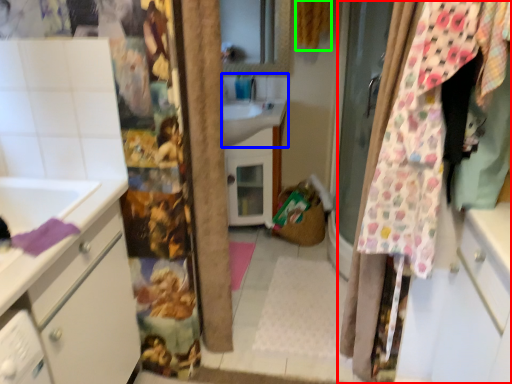
Question: Which is nearer to the curtain (highlighted by a red box)? sink (highlighted by a blue box) or curtain (highlighted by a green box).

Choices:
 (A) sink
 (B) curtain

Answer: (A)